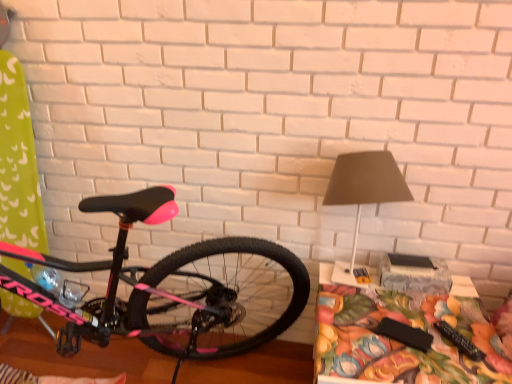
Question: Is pink matte bicycle at left to the left of floral fabric table at lower right from the viewer's perspective?

Choices:
 (A) yes
 (B) no

Answer: (A)

Question: From the image's perspective, is pink matte bicycle at left on floral fabric table at lower right?

Choices:
 (A) yes
 (B) no

Answer: (A)

Question: Considering the relative positions of pink matte bicycle at left and floral fabric table at lower right in the image provided, is pink matte bicycle at left to the right of floral fabric table at lower right from the viewer's perspective?

Choices:
 (A) no
 (B) yes

Answer: (A)

Question: Can you confirm if pink matte bicycle at left is thinner than floral fabric table at lower right?

Choices:
 (A) no
 (B) yes

Answer: (A)

Question: Is pink matte bicycle at left facing away from floral fabric table at lower right?

Choices:
 (A) no
 (B) yes

Answer: (B)

Question: Can you confirm if pink matte bicycle at left is taller than floral fabric table at lower right?

Choices:
 (A) yes
 (B) no

Answer: (A)

Question: Would you say pink matte bicycle at left is a long distance from matte gray lampshade at upper right?

Choices:
 (A) no
 (B) yes

Answer: (A)

Question: From the image's perspective, is pink matte bicycle at left on matte gray lampshade at upper right?

Choices:
 (A) yes
 (B) no

Answer: (B)

Question: Considering the relative positions of pink matte bicycle at left and matte gray lampshade at upper right in the image provided, is pink matte bicycle at left to the left of matte gray lampshade at upper right from the viewer's perspective?

Choices:
 (A) yes
 (B) no

Answer: (A)

Question: Is pink matte bicycle at left positioned behind matte gray lampshade at upper right?

Choices:
 (A) no
 (B) yes

Answer: (A)

Question: Considering the relative positions of pink matte bicycle at left and matte gray lampshade at upper right in the image provided, is pink matte bicycle at left to the right of matte gray lampshade at upper right from the viewer's perspective?

Choices:
 (A) no
 (B) yes

Answer: (A)

Question: From a real-world perspective, is pink matte bicycle at left below matte gray lampshade at upper right?

Choices:
 (A) yes
 (B) no

Answer: (A)

Question: From the image's perspective, does matte gray lampshade at upper right appear lower than pink matte bicycle at left?

Choices:
 (A) yes
 (B) no

Answer: (B)